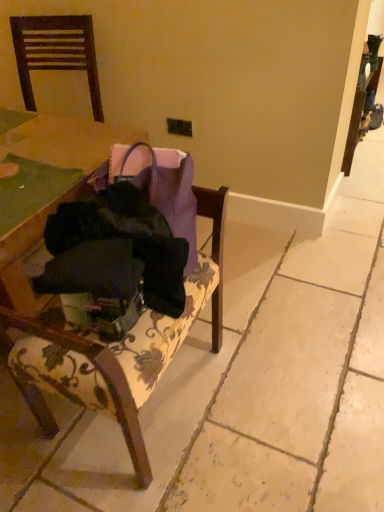
Measure the distance between velvet floral-patterned chair at center, the 1th chair from the bottom, and camera.

velvet floral-patterned chair at center, the 1th chair from the bottom, is 33.90 inches from camera.

Image resolution: width=384 pixels, height=512 pixels. In order to click on velvet floral-patterned chair at center, acting as the 2th chair starting from the left in this screenshot , I will do `click(102, 344)`.

Considering the relative sizes of velvet floral-patterned chair at center, acting as the 2th chair starting from the left, and dark wood chair at upper left, positioned as the 1th chair in left-to-right order, in the image provided, is velvet floral-patterned chair at center, acting as the 2th chair starting from the left, shorter than dark wood chair at upper left, positioned as the 1th chair in left-to-right order,?

No, velvet floral-patterned chair at center, acting as the 2th chair starting from the left, is not shorter than dark wood chair at upper left, positioned as the 1th chair in left-to-right order.

Considering the relative positions of velvet floral-patterned chair at center, which is counted as the 1th chair, starting from the right, and dark wood chair at upper left, which appears as the first chair when viewed from the top, in the image provided, is velvet floral-patterned chair at center, which is counted as the 1th chair, starting from the right, behind dark wood chair at upper left, which appears as the first chair when viewed from the top,?

That is False.

What's the angular difference between velvet floral-patterned chair at center, which is counted as the 1th chair, starting from the right, and dark wood chair at upper left, which appears as the first chair when viewed from the top,'s facing directions?

102 degrees.

Is there a large distance between velvet floral-patterned chair at center, the 1th chair from the bottom, and dark wood chair at upper left, which appears as the second chair when ordered from the bottom?

Yes.

Considering the sizes of black fabric bag at center and velvet floral-patterned chair at center, which is counted as the 1th chair, starting from the right, in the image, is black fabric bag at center taller or shorter than velvet floral-patterned chair at center, which is counted as the 1th chair, starting from the right,?

In the image, black fabric bag at center appears to be shorter than velvet floral-patterned chair at center, which is counted as the 1th chair, starting from the right.

Does black fabric bag at center appear on the right side of velvet floral-patterned chair at center, which is counted as the 1th chair, starting from the right?

Correct, you'll find black fabric bag at center to the right of velvet floral-patterned chair at center, which is counted as the 1th chair, starting from the right.

How far apart are black fabric bag at center and velvet floral-patterned chair at center, which appears as the 2th chair when viewed from the top?

A distance of 6.48 inches exists between black fabric bag at center and velvet floral-patterned chair at center, which appears as the 2th chair when viewed from the top.

Between black fabric bag at center and velvet floral-patterned chair at center, which is counted as the 1th chair, starting from the right, which one has larger size?

velvet floral-patterned chair at center, which is counted as the 1th chair, starting from the right.

Is black fabric bag at center not near dark wood chair at upper left, which appears as the first chair when viewed from the top?

Absolutely, black fabric bag at center is distant from dark wood chair at upper left, which appears as the first chair when viewed from the top.

Based on the photo, is black fabric bag at center inside or outside of dark wood chair at upper left, acting as the 2th chair starting from the right?

black fabric bag at center is spatially situated outside dark wood chair at upper left, acting as the 2th chair starting from the right.

Which of these two, black fabric bag at center or dark wood chair at upper left, acting as the 2th chair starting from the right, stands taller?

Standing taller between the two is dark wood chair at upper left, acting as the 2th chair starting from the right.

Is point (124, 224) closer to viewer compared to point (22, 52)?

Yes, point (124, 224) is closer to viewer.

How distant is dark wood chair at upper left, acting as the 2th chair starting from the right, from black fabric bag at center?

dark wood chair at upper left, acting as the 2th chair starting from the right, and black fabric bag at center are 4.48 feet apart.

Is dark wood chair at upper left, acting as the 2th chair starting from the right, taller or shorter than black fabric bag at center?

dark wood chair at upper left, acting as the 2th chair starting from the right, is taller than black fabric bag at center.

Is point (34, 28) positioned behind point (94, 309)?

Yes, point (34, 28) is behind point (94, 309).

Does dark wood chair at upper left, positioned as the 1th chair in left-to-right order, appear on the left side of velvet floral-patterned chair at center, which appears as the 2th chair when viewed from the top?

Yes, dark wood chair at upper left, positioned as the 1th chair in left-to-right order, is to the left of velvet floral-patterned chair at center, which appears as the 2th chair when viewed from the top.

From the image's perspective, which object appears higher, dark wood chair at upper left, which appears as the first chair when viewed from the top, or velvet floral-patterned chair at center, which is counted as the 1th chair, starting from the right?

dark wood chair at upper left, which appears as the first chair when viewed from the top, from the image's perspective.

Which of these two, dark wood chair at upper left, positioned as the 1th chair in left-to-right order, or velvet floral-patterned chair at center, acting as the 2th chair starting from the left, is smaller?

With smaller size is dark wood chair at upper left, positioned as the 1th chair in left-to-right order.

Does velvet floral-patterned chair at center, acting as the 2th chair starting from the left, touch black fabric bag at center?

No, velvet floral-patterned chair at center, acting as the 2th chair starting from the left, is not making contact with black fabric bag at center.

Is velvet floral-patterned chair at center, the 1th chair from the bottom, positioned with its back to black fabric bag at center?

No.

From the picture: Relative to black fabric bag at center, is velvet floral-patterned chair at center, the 1th chair from the bottom, in front or behind?

Visually, velvet floral-patterned chair at center, the 1th chair from the bottom, is located in front of black fabric bag at center.

Can you confirm if velvet floral-patterned chair at center, the 1th chair from the bottom, is smaller than black fabric bag at center?

Actually, velvet floral-patterned chair at center, the 1th chair from the bottom, might be larger than black fabric bag at center.

The image size is (384, 512). I want to click on chair below the dark wood chair at upper left, acting as the 2th chair starting from the right (from a real-world perspective), so click(x=102, y=344).

Locate an element on the screen. The image size is (384, 512). clothing lying on the right of velvet floral-patterned chair at center, the 1th chair from the bottom is located at coordinates (113, 260).

Based on their spatial positions, is black fabric bag at center or dark wood chair at upper left, positioned as the 1th chair in left-to-right order, closer to velvet floral-patterned chair at center, which appears as the 2th chair when viewed from the top?

black fabric bag at center is positioned closer to the anchor velvet floral-patterned chair at center, which appears as the 2th chair when viewed from the top.

Estimate the real-world distances between objects in this image. Which object is further from black fabric bag at center, dark wood chair at upper left, positioned as the 1th chair in left-to-right order, or velvet floral-patterned chair at center, the 1th chair from the bottom?

Based on the image, dark wood chair at upper left, positioned as the 1th chair in left-to-right order, appears to be further to black fabric bag at center.

Which object lies nearer to the anchor point black fabric bag at center, velvet floral-patterned chair at center, which is counted as the 1th chair, starting from the right, or dark wood chair at upper left, which appears as the second chair when ordered from the bottom?

Based on the image, velvet floral-patterned chair at center, which is counted as the 1th chair, starting from the right, appears to be nearer to black fabric bag at center.

From the image, which object appears to be nearer to velvet floral-patterned chair at center, which appears as the 2th chair when viewed from the top, dark wood chair at upper left, acting as the 2th chair starting from the right, or black fabric bag at center?

black fabric bag at center.

Estimate the real-world distances between objects in this image. Which object is further from dark wood chair at upper left, which appears as the first chair when viewed from the top, velvet floral-patterned chair at center, acting as the 2th chair starting from the left, or black fabric bag at center?

The object further to dark wood chair at upper left, which appears as the first chair when viewed from the top, is black fabric bag at center.

Based on their spatial positions, is black fabric bag at center or velvet floral-patterned chair at center, which is counted as the 1th chair, starting from the right, closer to dark wood chair at upper left, acting as the 2th chair starting from the right?

velvet floral-patterned chair at center, which is counted as the 1th chair, starting from the right, is positioned closer to the anchor dark wood chair at upper left, acting as the 2th chair starting from the right.

Identify the location of clothing between dark wood chair at upper left, which appears as the second chair when ordered from the bottom, and velvet floral-patterned chair at center, which is counted as the 1th chair, starting from the right, vertically. (113, 260).